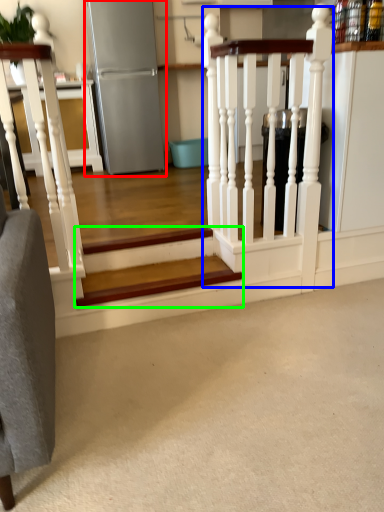
Question: Considering the real-world distances, which object is farthest from appliance (highlighted by a red box)? rail (highlighted by a blue box) or stairs (highlighted by a green box)?

Choices:
 (A) rail
 (B) stairs

Answer: (B)